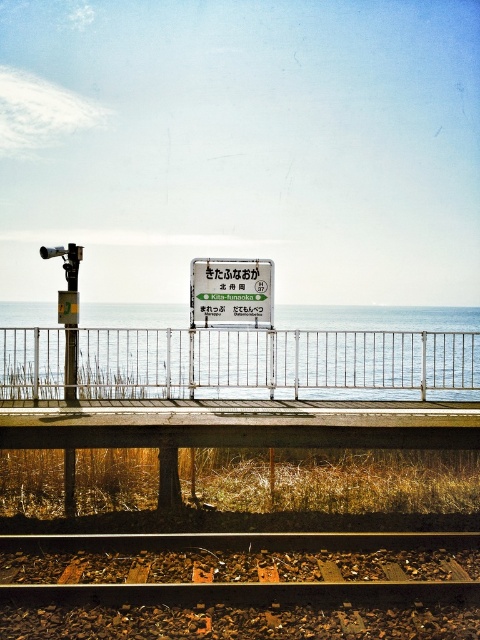
Does blue water at center appear on the right side of metallic sign at center?

In fact, blue water at center is to the left of metallic sign at center.

Where is `blue water at center`? The width and height of the screenshot is (480, 640). blue water at center is located at coordinates (345, 355).